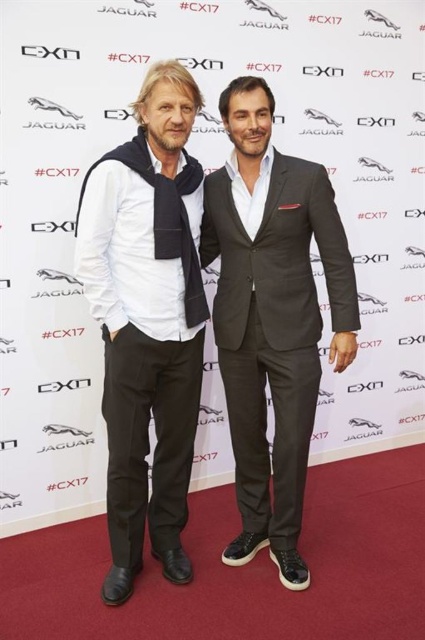
Question: Which point is farther from the camera taking this photo?

Choices:
 (A) 277,394
 (B) 125,243

Answer: (A)

Question: Does matte black scarf at left appear over dark gray suit at center?

Choices:
 (A) no
 (B) yes

Answer: (B)

Question: Is matte black scarf at left above dark gray suit at center?

Choices:
 (A) yes
 (B) no

Answer: (A)

Question: Which of the following is the farthest from the observer?

Choices:
 (A) (144, 301)
 (B) (311, 323)

Answer: (B)

Question: Is matte black scarf at left to the right of dark gray suit at center from the viewer's perspective?

Choices:
 (A) no
 (B) yes

Answer: (A)